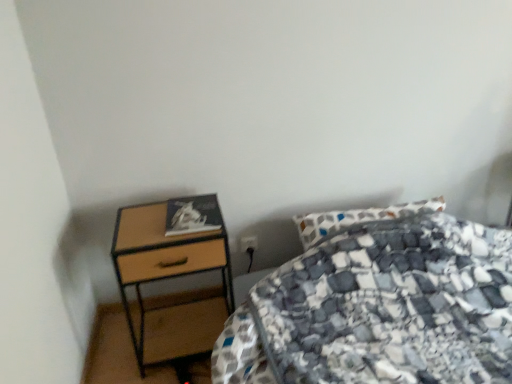
Question: Does black plastic power plug at lower center have a lesser height compared to woodenmaterial/texturenightstand at left?

Choices:
 (A) no
 (B) yes

Answer: (B)

Question: Is black plastic power plug at lower center facing towards woodenmaterial/texturenightstand at left?

Choices:
 (A) no
 (B) yes

Answer: (A)

Question: From a real-world perspective, is black plastic power plug at lower center below woodenmaterial/texturenightstand at left?

Choices:
 (A) no
 (B) yes

Answer: (B)

Question: Considering the relative sizes of black plastic power plug at lower center and woodenmaterial/texturenightstand at left in the image provided, is black plastic power plug at lower center taller than woodenmaterial/texturenightstand at left?

Choices:
 (A) yes
 (B) no

Answer: (B)

Question: Are black plastic power plug at lower center and woodenmaterial/texturenightstand at left making contact?

Choices:
 (A) yes
 (B) no

Answer: (B)

Question: Is black plastic power plug at lower center far away from woodenmaterial/texturenightstand at left?

Choices:
 (A) no
 (B) yes

Answer: (A)

Question: Is woodenmaterial/texturenightstand at left facing towards patterned fabric bed at center?

Choices:
 (A) yes
 (B) no

Answer: (B)

Question: Can you confirm if woodenmaterial/texturenightstand at left is smaller than patterned fabric bed at center?

Choices:
 (A) yes
 (B) no

Answer: (A)

Question: Is woodenmaterial/texturenightstand at left completely or partially outside of patterned fabric bed at center?

Choices:
 (A) no
 (B) yes

Answer: (B)

Question: Is woodenmaterial/texturenightstand at left directly adjacent to patterned fabric bed at center?

Choices:
 (A) no
 (B) yes

Answer: (A)

Question: From the image's perspective, would you say woodenmaterial/texturenightstand at left is shown under patterned fabric bed at center?

Choices:
 (A) no
 (B) yes

Answer: (A)

Question: Is woodenmaterial/texturenightstand at left shorter than patterned fabric bed at center?

Choices:
 (A) yes
 (B) no

Answer: (B)

Question: Considering the relative positions of patterned fabric bed at center and black plastic power plug at lower center in the image provided, is patterned fabric bed at center to the right of black plastic power plug at lower center from the viewer's perspective?

Choices:
 (A) no
 (B) yes

Answer: (B)